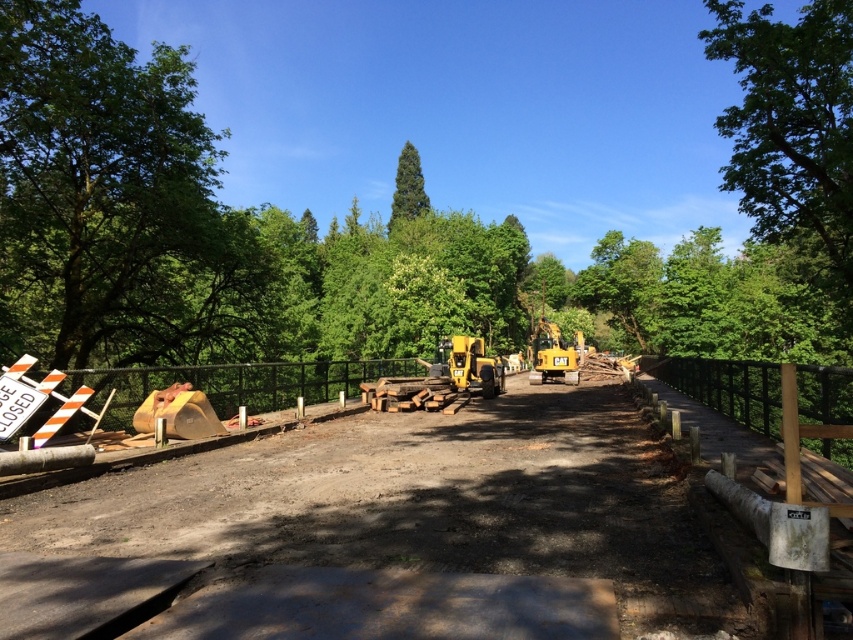
You are a delivery driver who needs to pass through the construction site. You see the yellow metallic excavator at center and the green matte tree at center. Which object is closer to the ground?

The yellow metallic excavator at center is located below the green matte tree at center, so the yellow metallic excavator at center is closer to the ground.

You are a construction worker standing on the dirt road looking at the matte yellow construction equipment at center and the yellow metallic excavator at center. Which equipment is positioned lower in the image?

The matte yellow construction equipment at center is positioned below the yellow metallic excavator at center, so it is lower in the image.

You are a delivery truck driver who needs to pass through the construction site. You see the matte yellow construction equipment at center and the yellow metallic excavator at center. Which vehicle should you avoid to ensure your truck can pass through the narrow path between them?

The matte yellow construction equipment at center might be wider than the yellow metallic excavator at center, so you should avoid the matte yellow construction equipment at center to ensure your truck can pass through the narrow path between them.